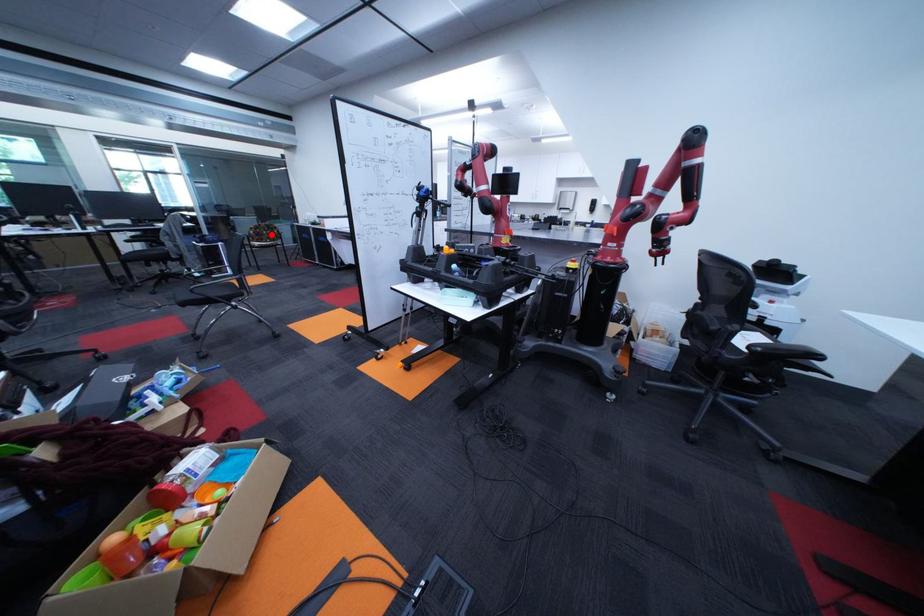
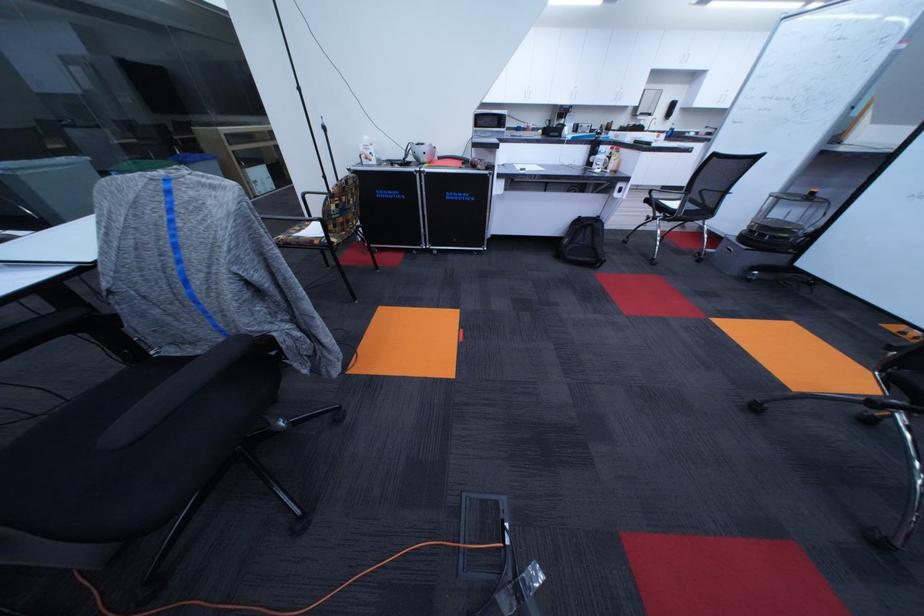
Question: I am providing you with two images of the same scene from different viewpoints. A red point is shown in image1. For the corresponding object point in image2, is it positioned nearer or farther from the camera?

Choices:
 (A) Nearer
 (B) Farther

Answer: (A)